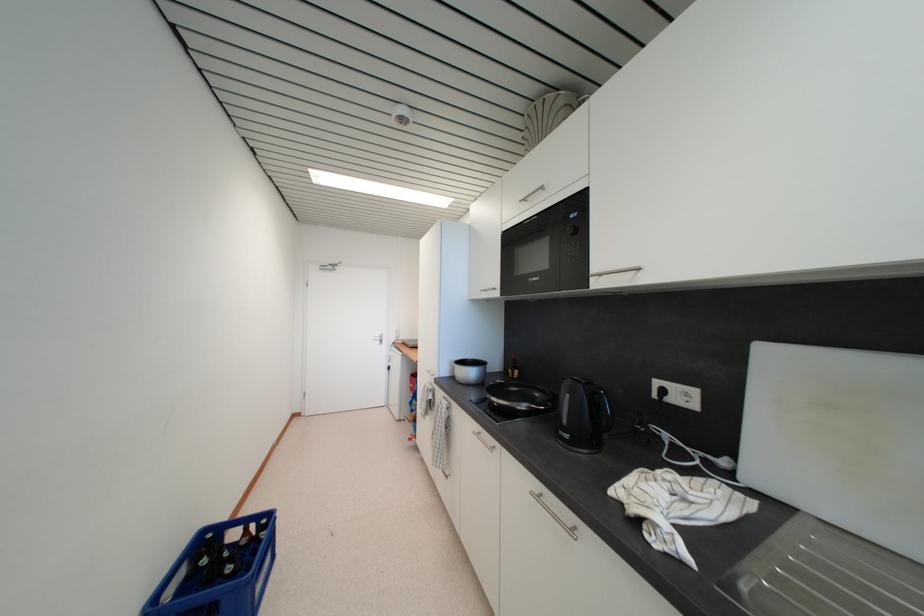
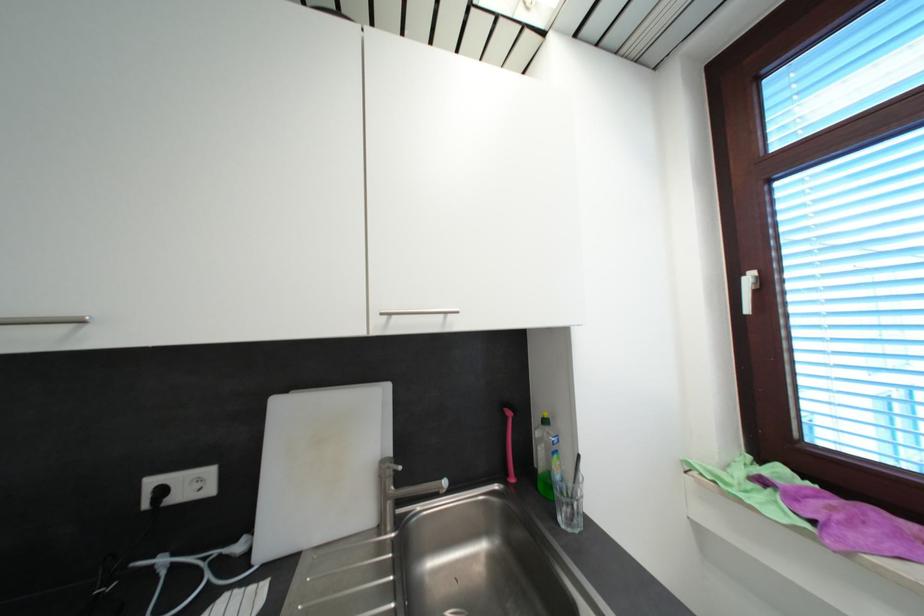
Question: Based on the continuous images, in which direction is the camera rotating? Reply with the corresponding letter.

Choices:
 (A) Left
 (B) Right
 (C) Up
 (D) Down

Answer: (B)